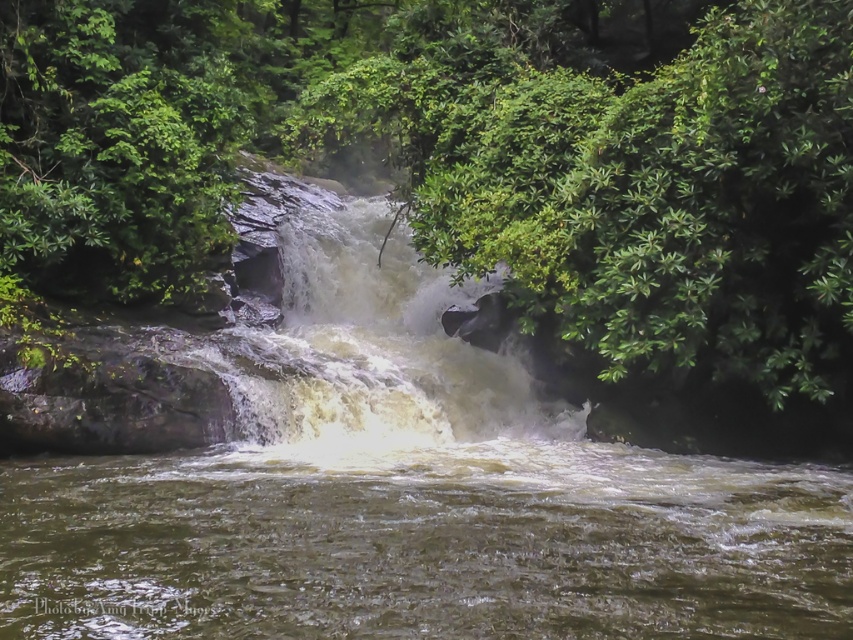
Is green leafy tree at center to the left of white frothy water at center from the viewer's perspective?

Yes, green leafy tree at center is to the left of white frothy water at center.

Can you confirm if green leafy tree at center is smaller than white frothy water at center?

Actually, green leafy tree at center might be larger than white frothy water at center.

Between point (642, 172) and point (241, 364), which one is positioned in front?

Point (642, 172) is in front.

Where is `green leafy tree at center`? This screenshot has width=853, height=640. green leafy tree at center is located at coordinates (466, 157).